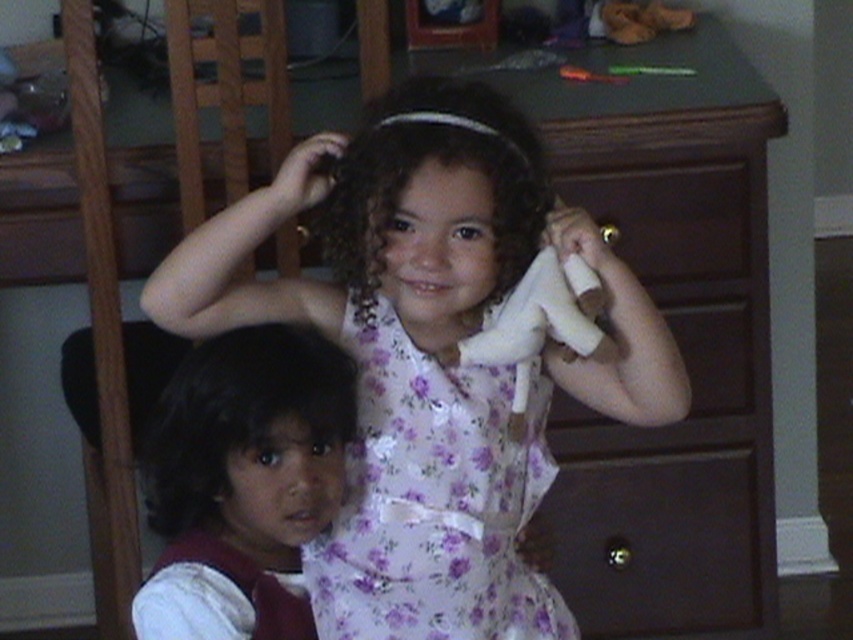
Is point (358, 541) more distant than point (345, 211)?

Yes, point (358, 541) is behind point (345, 211).

Which is more to the right, floral fabric dress at center or curly brown hair at center?

Positioned to the right is floral fabric dress at center.

Is point (424, 476) more distant than point (517, 230)?

Yes.

The image size is (853, 640). I want to click on floral fabric dress at center, so click(433, 500).

Can you confirm if curly brown hair at center is positioned to the right of brown wood drawer at center?

In fact, curly brown hair at center is to the left of brown wood drawer at center.

Is curly brown hair at center behind brown wood drawer at center?

No, curly brown hair at center is in front of brown wood drawer at center.

This screenshot has height=640, width=853. What do you see at coordinates (440, 163) in the screenshot? I see `curly brown hair at center` at bounding box center [440, 163].

Where is `curly brown hair at center`? Image resolution: width=853 pixels, height=640 pixels. curly brown hair at center is located at coordinates (440, 163).

Between white floral dress at center and brown wood dresser at upper center, which one has more height?

Standing taller between the two is brown wood dresser at upper center.

Image resolution: width=853 pixels, height=640 pixels. What do you see at coordinates (428, 355) in the screenshot?
I see `white floral dress at center` at bounding box center [428, 355].

You are a GUI agent. You are given a task and a screenshot of the screen. Output one action in this format:
    pyautogui.click(x=<x>, y=<y>)
    Task: Click on the white floral dress at center
    
    Given the screenshot: What is the action you would take?
    click(x=428, y=355)